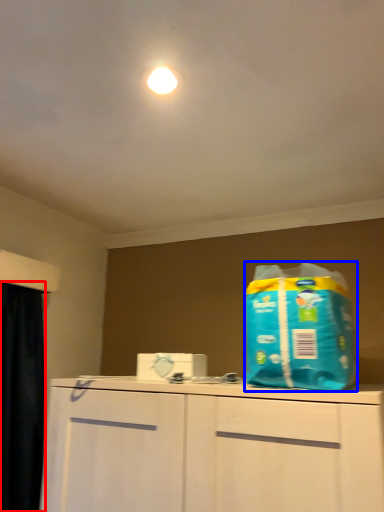
Question: Which of the following is the closest to the observer, curtain (highlighted by a red box) or cleaning product (highlighted by a blue box)?

Choices:
 (A) curtain
 (B) cleaning product

Answer: (B)